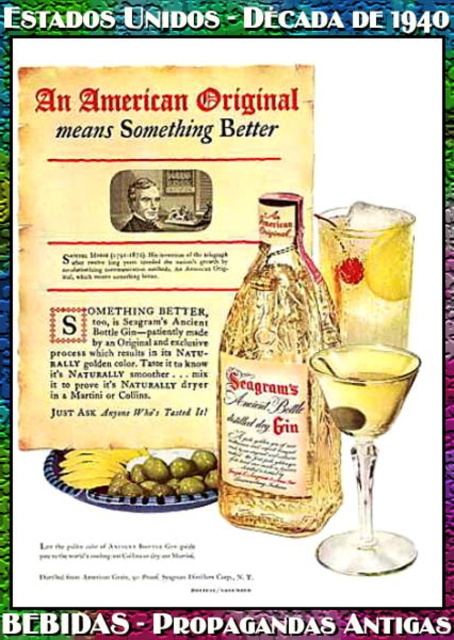
Question: Among these objects, which one is farthest from the camera?

Choices:
 (A) clear glass drink at center right
 (B) clear glass bottle at center
 (C) transparent glass martini glass at center
 (D) yellow liquid at center

Answer: (A)

Question: Which of the following is the closest to the observer?

Choices:
 (A) clear glass drink at center right
 (B) transparent glass martini glass at center

Answer: (B)

Question: Is clear glass drink at center right above green matte olives at lower center?

Choices:
 (A) no
 (B) yes

Answer: (B)

Question: Can you confirm if clear glass bottle at center is positioned to the right of transparent glass martini glass at center?

Choices:
 (A) no
 (B) yes

Answer: (A)

Question: Among these objects, which one is nearest to the camera?

Choices:
 (A) transparent glass martini glass at center
 (B) yellow liquid at center
 (C) clear glass bottle at center

Answer: (A)

Question: Does clear glass bottle at center come behind clear glass drink at center right?

Choices:
 (A) no
 (B) yes

Answer: (A)